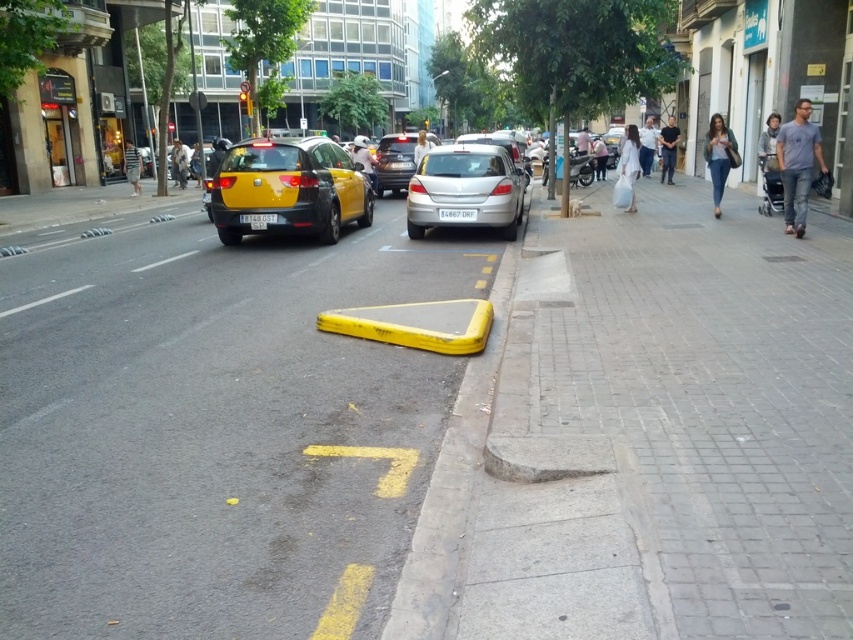
You are standing on the sidewalk near the curb and want to cross the road to reach the silver metallic sedan at center. The road is wet and has a yellow triangular traffic bollard lying on its side. Considering the distance, can you walk directly to the sedan without needing to go around any obstacles?

The silver metallic sedan at center is 6.99 meters away from you. Since the bollard is on the road but lying on its side, you can step over it or walk around it easily. The distance is manageable for a direct path, so yes, you can walk directly to the sedan.

You are a delivery person trying to park your silver metallic sedan at center in a spot that requires clearance under the car to be at least 1.5 meters. Given the light blue jeans at center, can your sedan safely pass under it?

The silver metallic sedan at center has a lesser height compared to light blue jeans at center. Since the sedan is shorter, it can safely pass under the light blue jeans at center as long as the clearance requirement is met.